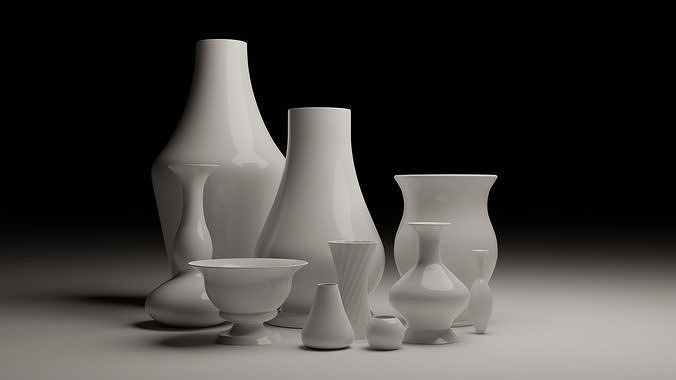
Where is `2 wide vases`? The height and width of the screenshot is (380, 676). 2 wide vases is located at coordinates pos(243,276), pos(439,224).